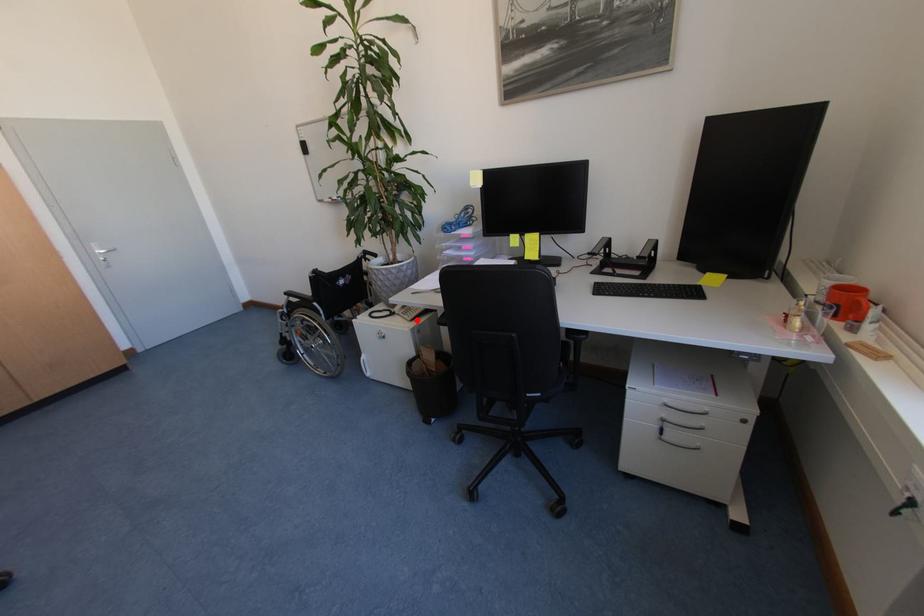
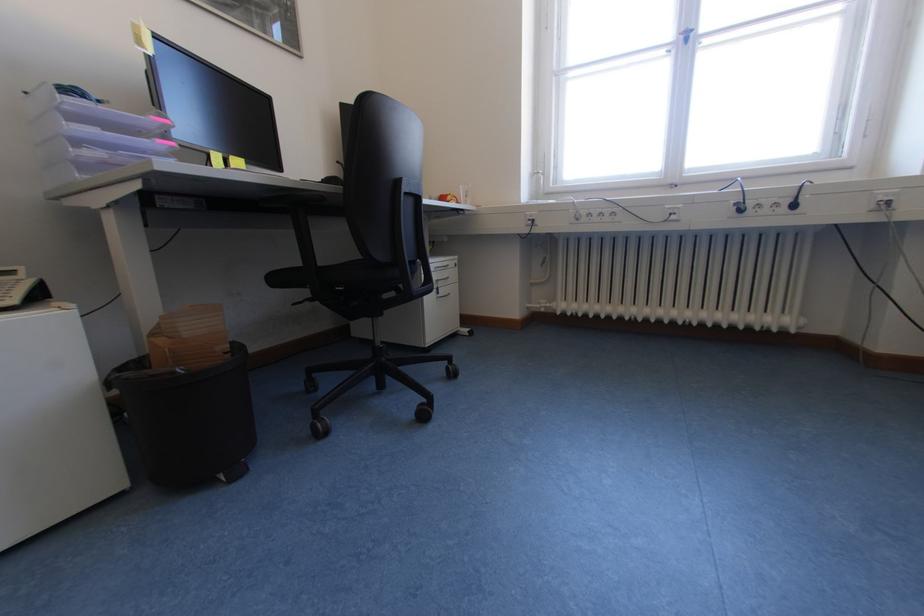
Question: I am providing you with two images of the same scene from different viewpoints. Image1 has a red point marked. In image2, the corresponding 3D location appears at what relative position? Reply with the corresponding letter.

Choices:
 (A) Closer
 (B) Farther

Answer: (B)